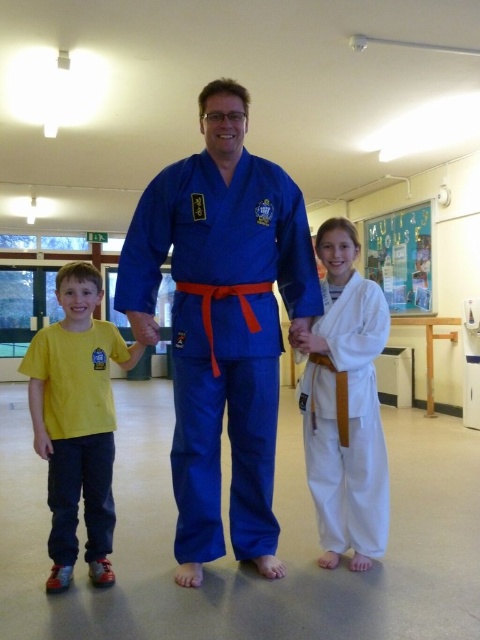
Question: Is white cotton karate uniform at center positioned before yellow cotton t-shirt at left?

Choices:
 (A) no
 (B) yes

Answer: (A)

Question: Does white cotton karate uniform at center have a greater width compared to yellow cotton t-shirt at left?

Choices:
 (A) yes
 (B) no

Answer: (B)

Question: Is blue fabric karate uniform at center wider than white cotton karate uniform at center?

Choices:
 (A) yes
 (B) no

Answer: (A)

Question: Which point is closer to the camera?

Choices:
 (A) white cotton karate uniform at center
 (B) blue fabric karate uniform at center

Answer: (B)

Question: Estimate the real-world distances between objects in this image. Which object is closer to the white cotton karate uniform at center?

Choices:
 (A) yellow cotton t-shirt at left
 (B) blue fabric karate uniform at center

Answer: (B)

Question: Which of the following is the closest to the observer?

Choices:
 (A) tap(60, 353)
 (B) tap(363, 364)
 (C) tap(314, 266)

Answer: (A)